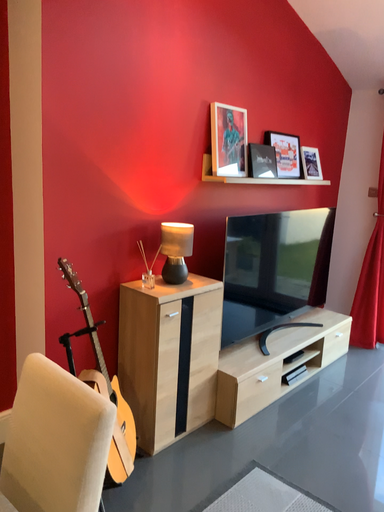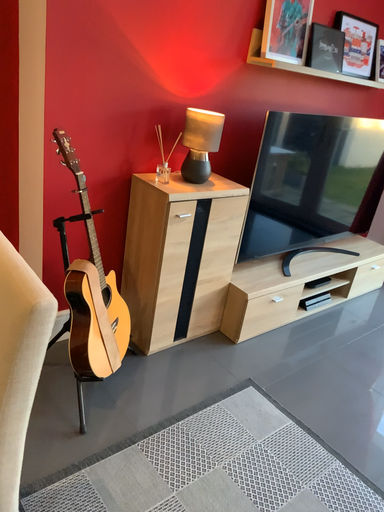
Question: How did the camera likely rotate when shooting the video?

Choices:
 (A) rotated right
 (B) rotated left

Answer: (B)